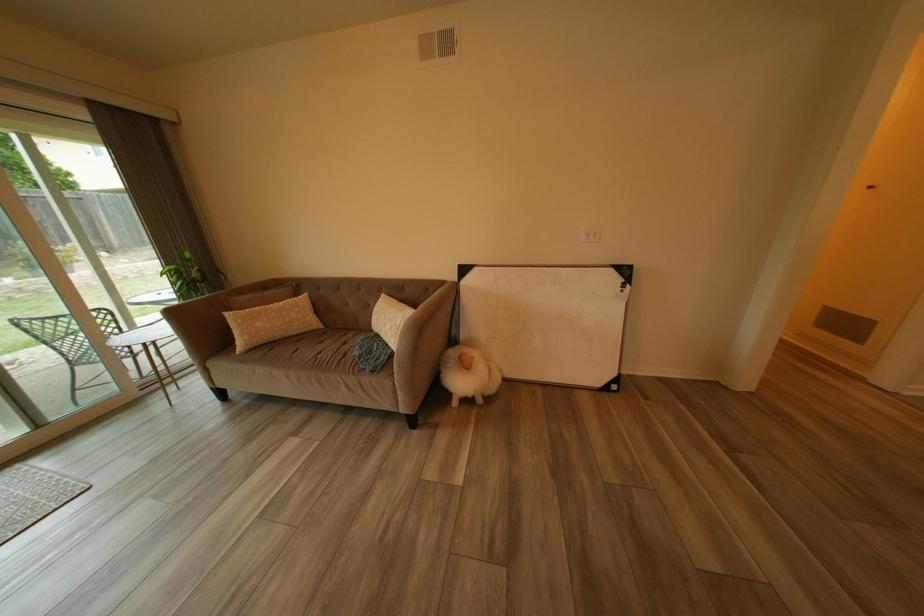
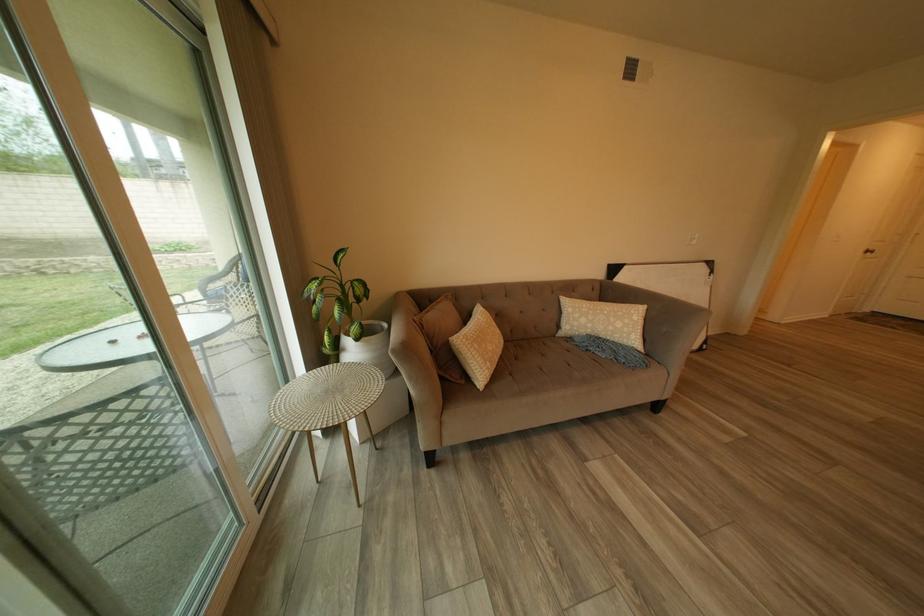
Question: The images are taken continuously from a first-person perspective. In which direction are you moving?

Choices:
 (A) Left
 (B) Right
 (C) Forward
 (D) Backward

Answer: (A)